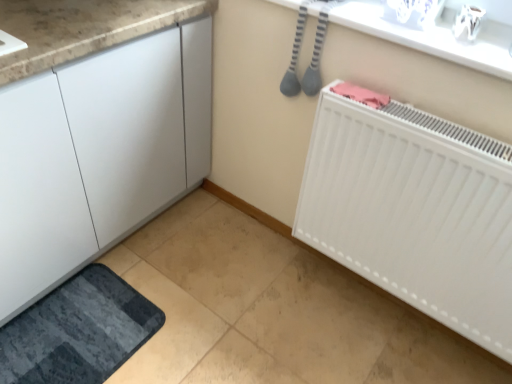
Where is `white matte radiator at lower right`? white matte radiator at lower right is located at coordinates (414, 211).

Considering the relative sizes of white glossy counter top at upper center and white matte radiator at lower right in the image provided, is white glossy counter top at upper center bigger than white matte radiator at lower right?

No, white glossy counter top at upper center is not bigger than white matte radiator at lower right.

Can you confirm if white glossy counter top at upper center is positioned to the left of white matte radiator at lower right?

Yes.

In terms of height, does white glossy counter top at upper center look taller or shorter compared to white matte radiator at lower right?

Considering their sizes, white glossy counter top at upper center has less height than white matte radiator at lower right.

Does point (433, 46) come in front of point (383, 252)?

Yes, point (433, 46) is closer to viewer.

How many degrees apart are the facing directions of white glossy counter top at upper center and dark gray textured bath mat at lower left?

There is a 90-degree angle between the facing directions of white glossy counter top at upper center and dark gray textured bath mat at lower left.

Can you confirm if white glossy counter top at upper center is taller than dark gray textured bath mat at lower left?

Incorrect, the height of white glossy counter top at upper center is not larger of that of dark gray textured bath mat at lower left.

From the image's perspective, which one is positioned lower, white glossy counter top at upper center or dark gray textured bath mat at lower left?

dark gray textured bath mat at lower left appears lower in the image.

Is white glossy counter top at upper center outside of dark gray textured bath mat at lower left?

Yes, white glossy counter top at upper center is outside of dark gray textured bath mat at lower left.

Is white matte radiator at lower right inside or outside of dark gray textured bath mat at lower left?

white matte radiator at lower right exists outside the volume of dark gray textured bath mat at lower left.

Between point (344, 233) and point (30, 333), which one is positioned in front?

The point (30, 333) is in front.

Is white matte radiator at lower right in front of dark gray textured bath mat at lower left?

That is True.

Is white matte radiator at lower right touching dark gray textured bath mat at lower left?

No, white matte radiator at lower right is not making contact with dark gray textured bath mat at lower left.

Would you say white matte radiator at lower right is outside white glossy counter top at upper center?

Yes, white matte radiator at lower right is not within white glossy counter top at upper center.

Which is behind, white matte radiator at lower right or white glossy counter top at upper center?

white glossy counter top at upper center is further from the camera.

Does white matte radiator at lower right have a lesser width compared to white glossy counter top at upper center?

Correct, the width of white matte radiator at lower right is less than that of white glossy counter top at upper center.

From the image's perspective, which one is positioned higher, white matte radiator at lower right or white glossy counter top at upper center?

white glossy counter top at upper center appears higher in the image.

Is dark gray textured bath mat at lower left wider than white matte radiator at lower right?

Correct, the width of dark gray textured bath mat at lower left exceeds that of white matte radiator at lower right.

Is dark gray textured bath mat at lower left to the left of white matte radiator at lower right from the viewer's perspective?

Correct, you'll find dark gray textured bath mat at lower left to the left of white matte radiator at lower right.

Is dark gray textured bath mat at lower left closer to the viewer compared to white matte radiator at lower right?

No, dark gray textured bath mat at lower left is further to the viewer.

Considering the relative sizes of dark gray textured bath mat at lower left and white matte radiator at lower right in the image provided, is dark gray textured bath mat at lower left smaller than white matte radiator at lower right?

Correct, dark gray textured bath mat at lower left occupies less space than white matte radiator at lower right.

Which object is positioned more to the right, dark gray textured bath mat at lower left or white glossy counter top at upper center?

white glossy counter top at upper center.

Which is closer, [75,306] or [458,45]?

Point [458,45]

How different are the orientations of dark gray textured bath mat at lower left and white glossy counter top at upper center in degrees?

They differ by 90 degrees in their facing directions.

Is dark gray textured bath mat at lower left facing towards white glossy counter top at upper center?

No, dark gray textured bath mat at lower left is not aimed at white glossy counter top at upper center.

This screenshot has width=512, height=384. I want to click on counter top located on the left of white matte radiator at lower right, so click(433, 38).

The height and width of the screenshot is (384, 512). I want to click on counter top above the dark gray textured bath mat at lower left (from a real-world perspective), so click(433, 38).

Looking at the image, which one is located closer to dark gray textured bath mat at lower left, white matte radiator at lower right or white glossy counter top at upper center?

Among the two, white matte radiator at lower right is located nearer to dark gray textured bath mat at lower left.

Which object lies nearer to the anchor point dark gray textured bath mat at lower left, white glossy counter top at upper center or white matte radiator at lower right?

white matte radiator at lower right lies closer to dark gray textured bath mat at lower left than the other object.

From the picture: Considering their positions, is dark gray textured bath mat at lower left positioned further to white matte radiator at lower right than white glossy counter top at upper center?

dark gray textured bath mat at lower left is positioned further to the anchor white matte radiator at lower right.

Considering their positions, is dark gray textured bath mat at lower left positioned closer to white glossy counter top at upper center than white matte radiator at lower right?

The object closer to white glossy counter top at upper center is white matte radiator at lower right.

Estimate the real-world distances between objects in this image. Which object is further from white glossy counter top at upper center, white matte radiator at lower right or dark gray textured bath mat at lower left?

dark gray textured bath mat at lower left lies further to white glossy counter top at upper center than the other object.

From the image, which object appears to be farther from white matte radiator at lower right, white glossy counter top at upper center or dark gray textured bath mat at lower left?

Based on the image, dark gray textured bath mat at lower left appears to be further to white matte radiator at lower right.

Find the location of `counter top between dark gray textured bath mat at lower left and white matte radiator at lower right in the horizontal direction`. counter top between dark gray textured bath mat at lower left and white matte radiator at lower right in the horizontal direction is located at coordinates (433, 38).